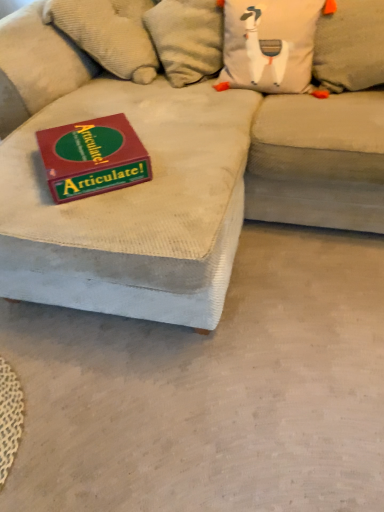
Locate an element on the screen. gray fabric pillow at upper right, the 2th pillow in the left-to-right sequence is located at coordinates (350, 46).

Image resolution: width=384 pixels, height=512 pixels. What do you see at coordinates (269, 44) in the screenshot? I see `white fabric pillow at upper center, the second pillow in the right-to-left sequence` at bounding box center [269, 44].

The width and height of the screenshot is (384, 512). Identify the location of beige corduroy couch at center. [172, 183].

At what (x,y) coordinates should I click in order to perform the action: click on matte red box at upper left. Please return your answer as a coordinate pair (x, y). The height and width of the screenshot is (512, 384). Looking at the image, I should click on (92, 157).

Image resolution: width=384 pixels, height=512 pixels. In order to click on gray fabric pillow at upper right, the 2th pillow in the left-to-right sequence in this screenshot , I will do `click(350, 46)`.

Consider the image. Is white fabric pillow at upper center, which is counted as the 1th pillow, starting from the left, outside of gray fabric pillow at upper right, the first pillow when ordered from right to left?

Yes, white fabric pillow at upper center, which is counted as the 1th pillow, starting from the left, is located beyond the bounds of gray fabric pillow at upper right, the first pillow when ordered from right to left.

Would you consider white fabric pillow at upper center, which is counted as the 1th pillow, starting from the left, to be distant from gray fabric pillow at upper right, the first pillow when ordered from right to left?

white fabric pillow at upper center, which is counted as the 1th pillow, starting from the left, is near gray fabric pillow at upper right, the first pillow when ordered from right to left, not far away.

Can you confirm if white fabric pillow at upper center, which is counted as the 1th pillow, starting from the left, is smaller than gray fabric pillow at upper right, the 2th pillow in the left-to-right sequence?

No.

Looking at this image, considering the relative sizes of white fabric pillow at upper center, the second pillow in the right-to-left sequence, and gray fabric pillow at upper right, the first pillow when ordered from right to left, in the image provided, is white fabric pillow at upper center, the second pillow in the right-to-left sequence, shorter than gray fabric pillow at upper right, the first pillow when ordered from right to left,?

Yes, white fabric pillow at upper center, the second pillow in the right-to-left sequence, is shorter than gray fabric pillow at upper right, the first pillow when ordered from right to left.

Between beige corduroy couch at center and matte red box at upper left, which one has larger width?

beige corduroy couch at center is wider.

Is matte red box at upper left completely or partially inside beige corduroy couch at center?

Absolutely, matte red box at upper left is inside beige corduroy couch at center.

From a real-world perspective, relative to matte red box at upper left, is beige corduroy couch at center vertically above or below?

beige corduroy couch at center is situated lower than matte red box at upper left in the real world.

Considering the sizes of beige corduroy couch at center and matte red box at upper left in the image, is beige corduroy couch at center bigger or smaller than matte red box at upper left?

In the image, beige corduroy couch at center appears to be larger than matte red box at upper left.

Based on their positions, is beige corduroy couch at center located to the left or right of gray fabric pillow at upper right, the first pillow when ordered from right to left?

beige corduroy couch at center is to the left of gray fabric pillow at upper right, the first pillow when ordered from right to left.

How many degrees apart are the facing directions of beige corduroy couch at center and gray fabric pillow at upper right, the 2th pillow in the left-to-right sequence?

The angular difference between beige corduroy couch at center and gray fabric pillow at upper right, the 2th pillow in the left-to-right sequence, is 9.53 degrees.

Identify the location of studio couch below the gray fabric pillow at upper right, the 2th pillow in the left-to-right sequence (from the image's perspective). Image resolution: width=384 pixels, height=512 pixels. (172, 183).

Is beige corduroy couch at center positioned beyond the bounds of gray fabric pillow at upper right, the 2th pillow in the left-to-right sequence?

Yes, beige corduroy couch at center is located beyond the bounds of gray fabric pillow at upper right, the 2th pillow in the left-to-right sequence.

How much distance is there between gray fabric pillow at upper right, the 2th pillow in the left-to-right sequence, and matte red box at upper left?

gray fabric pillow at upper right, the 2th pillow in the left-to-right sequence, and matte red box at upper left are 37.01 inches apart from each other.

Is gray fabric pillow at upper right, the 2th pillow in the left-to-right sequence, facing away from matte red box at upper left?

That's not correct — gray fabric pillow at upper right, the 2th pillow in the left-to-right sequence, is not looking away from matte red box at upper left.

From the image's perspective, which one is positioned lower, gray fabric pillow at upper right, the 2th pillow in the left-to-right sequence, or matte red box at upper left?

matte red box at upper left, from the image's perspective.

Is gray fabric pillow at upper right, the first pillow when ordered from right to left, far away from matte red box at upper left?

They are positioned close to each other.

Looking at this image, which of these two, white fabric pillow at upper center, which is counted as the 1th pillow, starting from the left, or beige corduroy couch at center, is smaller?

white fabric pillow at upper center, which is counted as the 1th pillow, starting from the left, is smaller.

Does white fabric pillow at upper center, which is counted as the 1th pillow, starting from the left, turn towards beige corduroy couch at center?

Yes.

Considering their positions, is white fabric pillow at upper center, which is counted as the 1th pillow, starting from the left, located in front of or behind beige corduroy couch at center?

white fabric pillow at upper center, which is counted as the 1th pillow, starting from the left, is behind beige corduroy couch at center.

From a real-world perspective, is white fabric pillow at upper center, the second pillow in the right-to-left sequence, located beneath beige corduroy couch at center?

No, from a real-world perspective, white fabric pillow at upper center, the second pillow in the right-to-left sequence, is not under beige corduroy couch at center.

Measure the distance from beige corduroy couch at center to white fabric pillow at upper center, which is counted as the 1th pillow, starting from the left.

42.33 centimeters.

Can white fabric pillow at upper center, which is counted as the 1th pillow, starting from the left, be found inside beige corduroy couch at center?

That's correct, white fabric pillow at upper center, which is counted as the 1th pillow, starting from the left, is inside beige corduroy couch at center.

At what (x,y) coordinates should I click in order to perform the action: click on studio couch on the left of white fabric pillow at upper center, the second pillow in the right-to-left sequence. Please return your answer as a coordinate pair (x, y). The image size is (384, 512). Looking at the image, I should click on (172, 183).

In the scene shown: In terms of width, does matte red box at upper left look wider or thinner when compared to gray fabric pillow at upper right, the first pillow when ordered from right to left?

In the image, matte red box at upper left appears to be wider than gray fabric pillow at upper right, the first pillow when ordered from right to left.

Does matte red box at upper left contain gray fabric pillow at upper right, the 2th pillow in the left-to-right sequence?

No.

Find the location of a particular element. Image resolution: width=384 pixels, height=512 pixels. pillow that is the 1st one above the matte red box at upper left (from a real-world perspective) is located at coordinates (350, 46).

The image size is (384, 512). Identify the location of pillow above the gray fabric pillow at upper right, the 2th pillow in the left-to-right sequence (from a real-world perspective). (269, 44).

Find the location of a particular element. This screenshot has height=512, width=384. studio couch beneath the matte red box at upper left (from a real-world perspective) is located at coordinates (172, 183).

Considering their positions, is beige corduroy couch at center positioned closer to white fabric pillow at upper center, which is counted as the 1th pillow, starting from the left, than matte red box at upper left?

Based on the image, beige corduroy couch at center appears to be nearer to white fabric pillow at upper center, which is counted as the 1th pillow, starting from the left.

Looking at the image, which one is located closer to gray fabric pillow at upper right, the first pillow when ordered from right to left, beige corduroy couch at center or matte red box at upper left?

The object closer to gray fabric pillow at upper right, the first pillow when ordered from right to left, is beige corduroy couch at center.

Considering their positions, is matte red box at upper left positioned closer to gray fabric pillow at upper right, the first pillow when ordered from right to left, than white fabric pillow at upper center, the second pillow in the right-to-left sequence?

The object closer to gray fabric pillow at upper right, the first pillow when ordered from right to left, is white fabric pillow at upper center, the second pillow in the right-to-left sequence.

Considering their positions, is gray fabric pillow at upper right, the 2th pillow in the left-to-right sequence, positioned further to matte red box at upper left than white fabric pillow at upper center, the second pillow in the right-to-left sequence?

gray fabric pillow at upper right, the 2th pillow in the left-to-right sequence, is further to matte red box at upper left.

Looking at this image, estimate the real-world distances between objects in this image. Which object is further from matte red box at upper left, beige corduroy couch at center or gray fabric pillow at upper right, the 2th pillow in the left-to-right sequence?

Among the two, gray fabric pillow at upper right, the 2th pillow in the left-to-right sequence, is located further to matte red box at upper left.

From the image, which object appears to be farther from matte red box at upper left, white fabric pillow at upper center, which is counted as the 1th pillow, starting from the left, or beige corduroy couch at center?

white fabric pillow at upper center, which is counted as the 1th pillow, starting from the left.

Estimate the real-world distances between objects in this image. Which object is closer to white fabric pillow at upper center, which is counted as the 1th pillow, starting from the left, matte red box at upper left or gray fabric pillow at upper right, the first pillow when ordered from right to left?

gray fabric pillow at upper right, the first pillow when ordered from right to left, is closer to white fabric pillow at upper center, which is counted as the 1th pillow, starting from the left.

Looking at the image, which one is located further to gray fabric pillow at upper right, the first pillow when ordered from right to left, white fabric pillow at upper center, the second pillow in the right-to-left sequence, or beige corduroy couch at center?

The object further to gray fabric pillow at upper right, the first pillow when ordered from right to left, is beige corduroy couch at center.

In order to click on studio couch between matte red box at upper left and gray fabric pillow at upper right, the 2th pillow in the left-to-right sequence, in the horizontal direction in this screenshot , I will do `click(172, 183)`.

At what (x,y) coordinates should I click in order to perform the action: click on pillow situated between matte red box at upper left and gray fabric pillow at upper right, the 2th pillow in the left-to-right sequence, from left to right. Please return your answer as a coordinate pair (x, y). Looking at the image, I should click on (269, 44).

The image size is (384, 512). What are the coordinates of `paperback book between beige corduroy couch at center and white fabric pillow at upper center, the second pillow in the right-to-left sequence, along the z-axis` in the screenshot? It's located at (x=92, y=157).

Where is `pillow between beige corduroy couch at center and white fabric pillow at upper center, the second pillow in the right-to-left sequence, from front to back`? pillow between beige corduroy couch at center and white fabric pillow at upper center, the second pillow in the right-to-left sequence, from front to back is located at coordinates (350, 46).